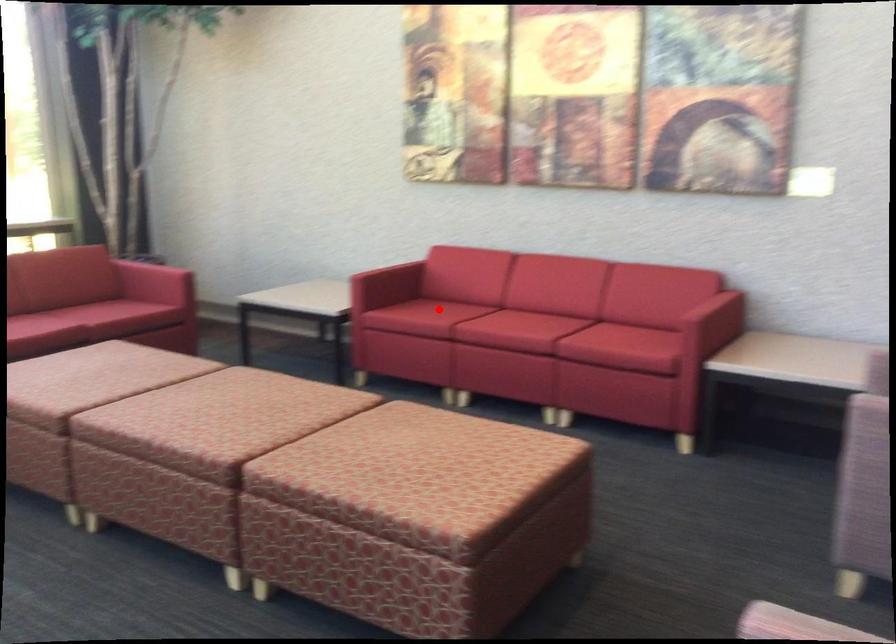
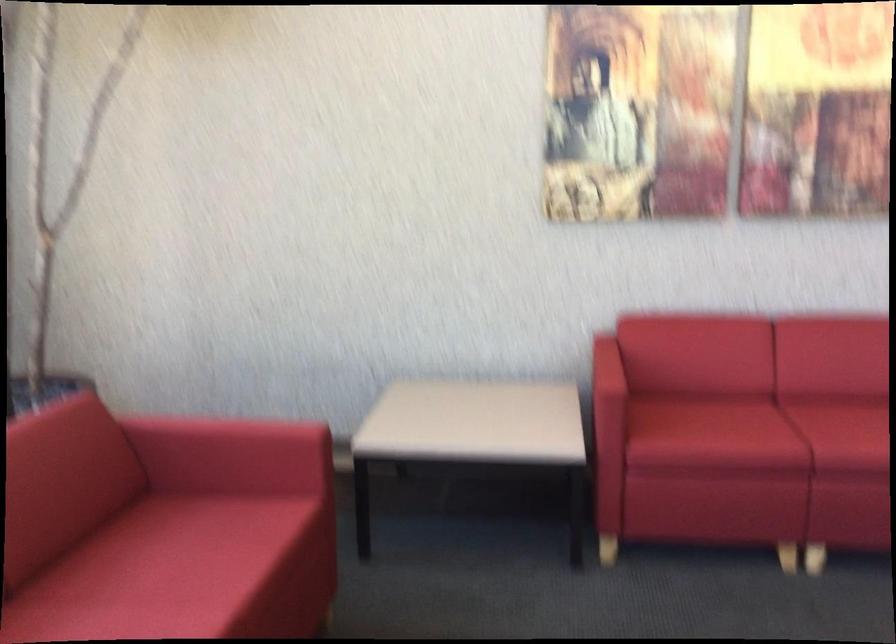
Where in the second image is the point corresponding to the highlighted location from the first image?

(757, 431)